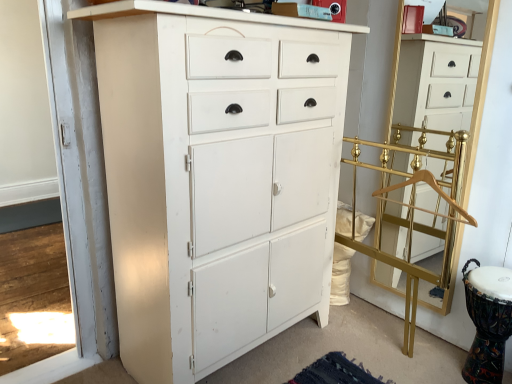
Question: From their relative heights in the image, would you say gold metallic coat rack at right, which is counted as the 2th chest of drawers, starting from the left, is taller or shorter than gold wooden hanger at right?

Choices:
 (A) short
 (B) tall

Answer: (B)

Question: From the image's perspective, is gold metallic coat rack at right, which is counted as the 2th chest of drawers, starting from the left, above or below gold wooden hanger at right?

Choices:
 (A) below
 (B) above

Answer: (B)

Question: Based on their relative distances, which object is nearer to the gold metallic coat rack at right, which is counted as the 2th chest of drawers, starting from the left?

Choices:
 (A) gold wooden hanger at right
 (B) white painted wood cabinet at center, acting as the first chest of drawers starting from the left
 (C) gold metallic coat rack at right

Answer: (A)

Question: Which object is positioned farthest from the gold metallic coat rack at right?

Choices:
 (A) gold metallic coat rack at right, which is counted as the 2th chest of drawers, starting from the left
 (B) gold wooden hanger at right
 (C) white painted wood cabinet at center, marked as the second chest of drawers in a right-to-left arrangement

Answer: (C)